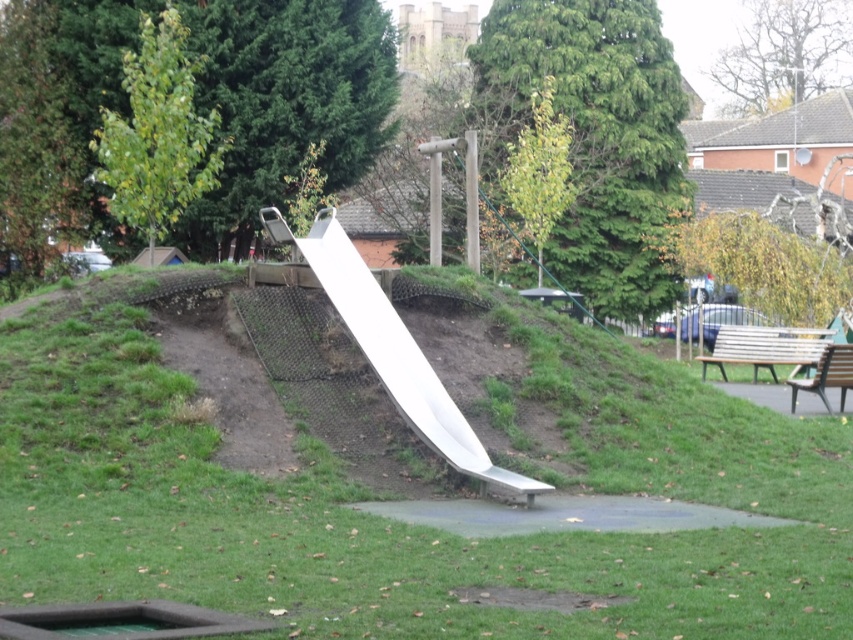
You are a parent trying to decide where to place your child for a photo. The white metallic slide at center and the wooden bench at right are both options. Which object would you choose if you want the subject to be framed against a more prominent background element?

The white metallic slide at center is larger in size than the wooden bench at right, so choosing the slide would allow the subject to be framed against the more prominent background elements like the distant castle or tower.

You are standing at point A located at coordinates (402, 477) in the playground. Looking around, you see the white slide on the grassy hill and the wooden structure to the right. Which direction should you walk to reach the white slide?

The white slide is located on the green grassy hill at center, so from point A at (402, 477), you should walk towards the center to reach the white slide.